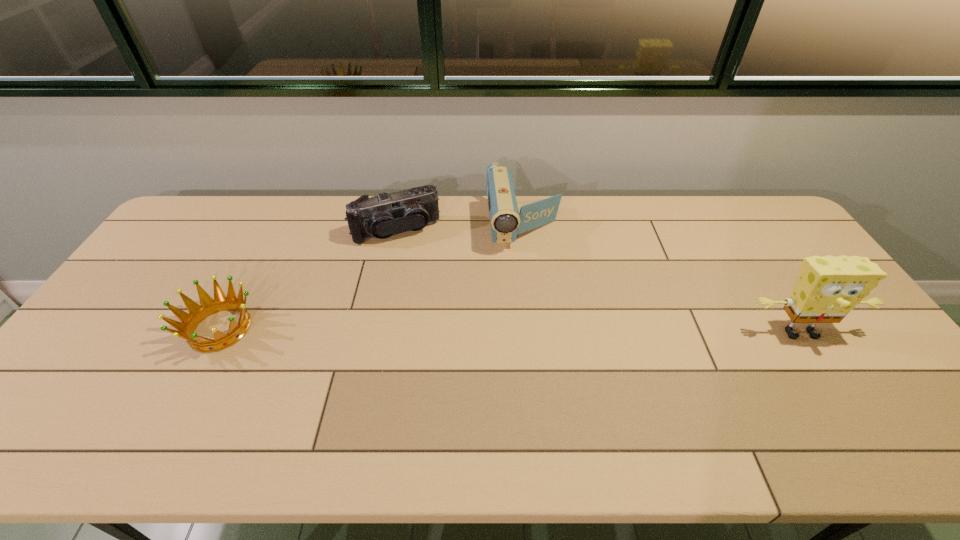
Where is `vacant spot on the desktop that is between the shortest object and the rightmost object and is positioned on the side of the second tallest object with the flip-out screen`? The height and width of the screenshot is (540, 960). vacant spot on the desktop that is between the shortest object and the rightmost object and is positioned on the side of the second tallest object with the flip-out screen is located at coordinates (543, 331).

Locate an element on the screen. free spot on the desktop that is between the shortest object and the tallest object and is positioned on the front-facing side of the left camcorder is located at coordinates (434, 330).